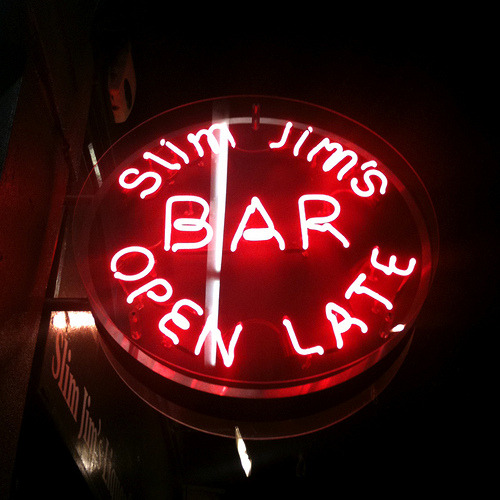
At what (x,y) coordinates should I click in order to perform the action: click on the left of neon sign. Please return your answer as a coordinate pair (x, y). The image size is (500, 500). Looking at the image, I should click on (34, 251).